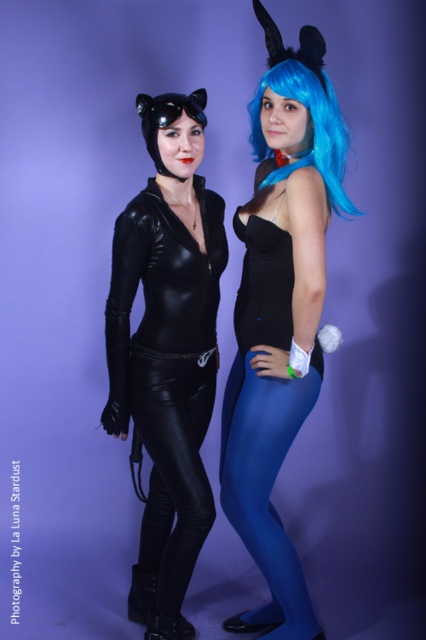
Question: Which object is positioned closest to the blue matte tights at lower center?

Choices:
 (A) blue synthetic wig at upper right
 (B) blue matte wig at upper right

Answer: (B)

Question: Is the position of black leather pants at lower center more distant than that of blue matte tights at lower center?

Choices:
 (A) no
 (B) yes

Answer: (B)

Question: Does blue matte tights at lower center have a smaller size compared to blue synthetic wig at upper right?

Choices:
 (A) yes
 (B) no

Answer: (B)

Question: Which object is positioned farthest from the blue matte tights at lower center?

Choices:
 (A) matte black bodysuit at center
 (B) blue synthetic wig at upper right

Answer: (B)

Question: From the image, what is the correct spatial relationship of matte black bodysuit at center in relation to black leather pants at lower center?

Choices:
 (A) left
 (B) right

Answer: (B)

Question: Which object appears farthest from the camera in this image?

Choices:
 (A) black leather pants at lower center
 (B) blue synthetic wig at upper right
 (C) blue matte wig at upper right

Answer: (A)